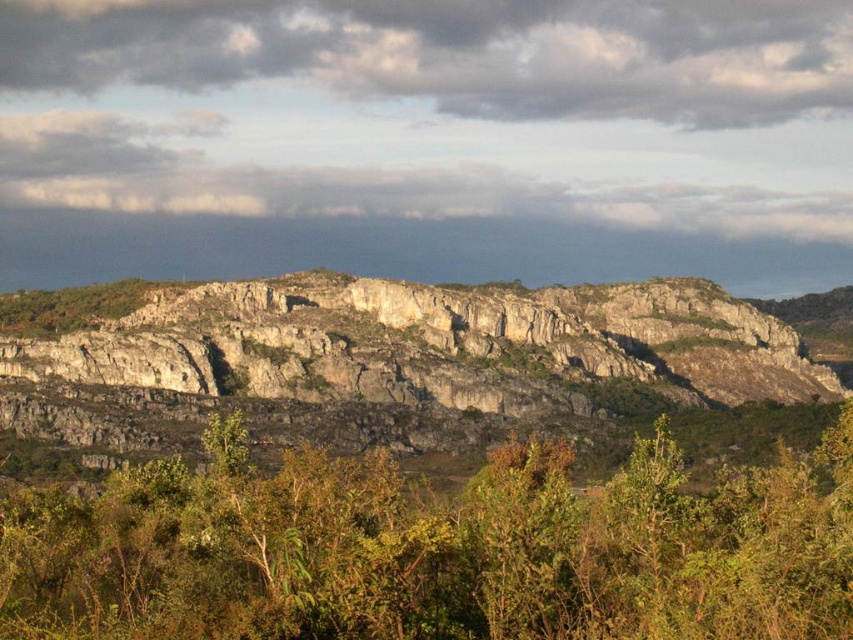
Question: Estimate the real-world distances between objects in this image. Which object is farther from the gray rock formation at center?

Choices:
 (A) green leafy shrub at center
 (B) cloudy sky at upper center

Answer: (B)

Question: Is green leafy shrub at center wider than gray rock formation at center?

Choices:
 (A) yes
 (B) no

Answer: (B)

Question: Which of the following is the closest to the observer?

Choices:
 (A) green leafy shrub at center
 (B) cloudy sky at upper center
 (C) gray rock formation at center

Answer: (A)

Question: Estimate the real-world distances between objects in this image. Which object is farther from the cloudy sky at upper center?

Choices:
 (A) green leafy shrub at center
 (B) gray rock formation at center

Answer: (A)

Question: Does green leafy shrub at center appear under gray rock formation at center?

Choices:
 (A) yes
 (B) no

Answer: (A)

Question: Is green leafy shrub at center to the right of gray rock formation at center from the viewer's perspective?

Choices:
 (A) yes
 (B) no

Answer: (A)